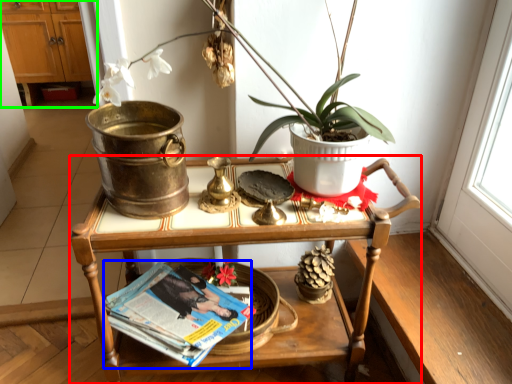
Question: Which object is positioned closest to table (highlighted by a red box)? Select from magazine (highlighted by a blue box) and dresser (highlighted by a green box).

Choices:
 (A) magazine
 (B) dresser

Answer: (A)